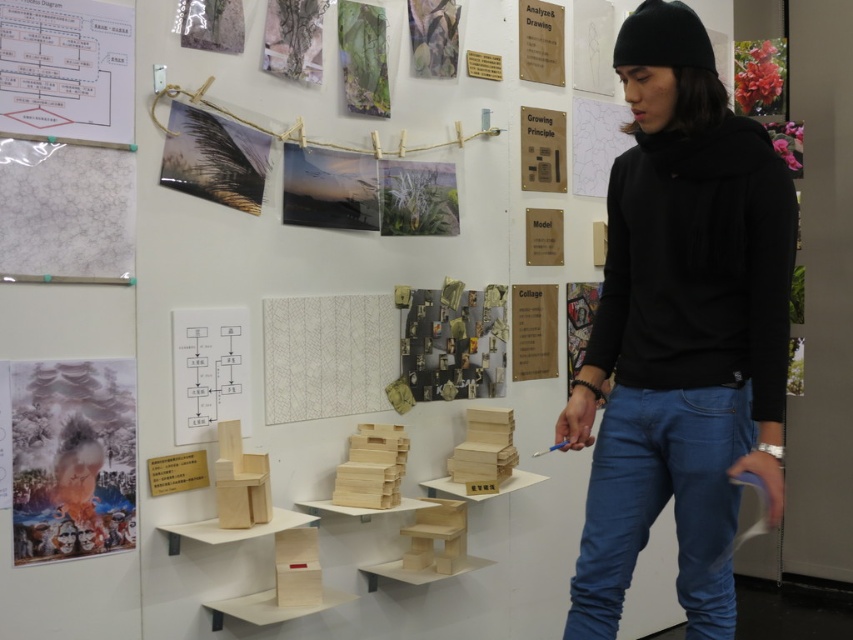
Question: Considering the real-world distances, which object is closest to the black cotton hoodie at upper right?

Choices:
 (A) blue denim jeans at lower right
 (B) matte paper poster at left
 (C) white paper at upper left

Answer: (A)

Question: Can you confirm if black cotton hoodie at upper right is positioned above white paper at upper left?

Choices:
 (A) no
 (B) yes

Answer: (A)

Question: Which object appears farthest from the camera in this image?

Choices:
 (A) white paper at upper left
 (B) black fleece sweatshirt at right
 (C) matte paper poster at left

Answer: (C)

Question: Based on their relative distances, which object is farther from the black cotton hoodie at upper right?

Choices:
 (A) blue denim jeans at lower right
 (B) matte paper poster at left
 (C) black fleece sweatshirt at right
 (D) white paper at upper left

Answer: (D)

Question: Does blue denim jeans at lower right appear on the left side of matte paper poster at left?

Choices:
 (A) no
 (B) yes

Answer: (A)

Question: Can you confirm if black fleece sweatshirt at right is smaller than blue denim jeans at lower right?

Choices:
 (A) yes
 (B) no

Answer: (B)